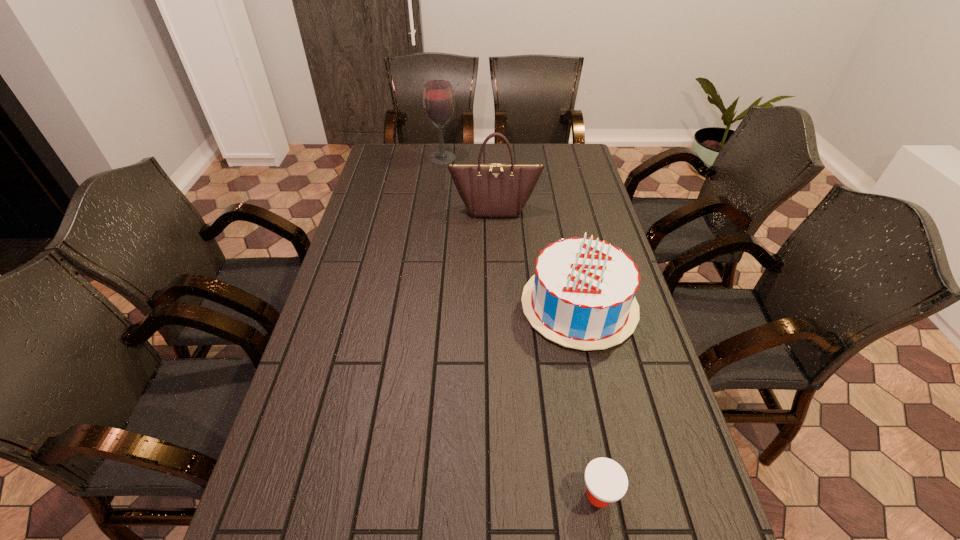
Where is `vacant area that lies between the handbag and the Dixie cup`? vacant area that lies between the handbag and the Dixie cup is located at coordinates (546, 352).

Identify the location of free space between the third tallest object and the third nearest object. (537, 258).

The image size is (960, 540). What are the coordinates of `empty location between the farthest object and the birthday cake` in the screenshot? It's located at click(511, 232).

Locate an element on the screen. free area in between the farthest object and the shortest object is located at coordinates (520, 327).

Find the location of a particular element. The width and height of the screenshot is (960, 540). free space that is in between the third nearest object and the third tallest object is located at coordinates (537, 258).

Locate an element on the screen. This screenshot has width=960, height=540. vacant space that's between the Dixie cup and the third farthest object is located at coordinates (588, 400).

Image resolution: width=960 pixels, height=540 pixels. In order to click on object that ranks as the second closest to the second nearest object in this screenshot , I will do `click(606, 481)`.

At what (x,y) coordinates should I click in order to perform the action: click on object that is the third nearest to the Dixie cup. Please return your answer as a coordinate pair (x, y). This screenshot has width=960, height=540. Looking at the image, I should click on (438, 99).

Locate an element on the screen. free space that satisfies the following two spatial constraints: 1. on the back side of the third farthest object; 2. on the left side of the shortest object is located at coordinates (564, 306).

The image size is (960, 540). I want to click on vacant area that satisfies the following two spatial constraints: 1. on the front-facing side of the shortest object; 2. on the right side of the second farthest object, so click(507, 495).